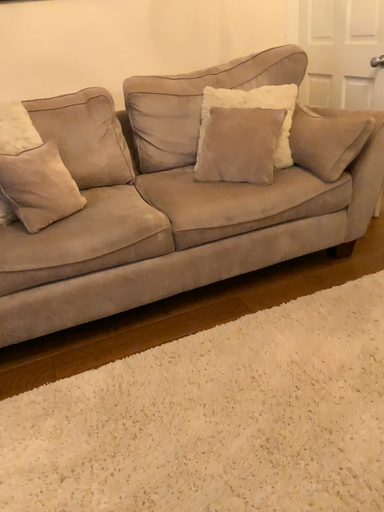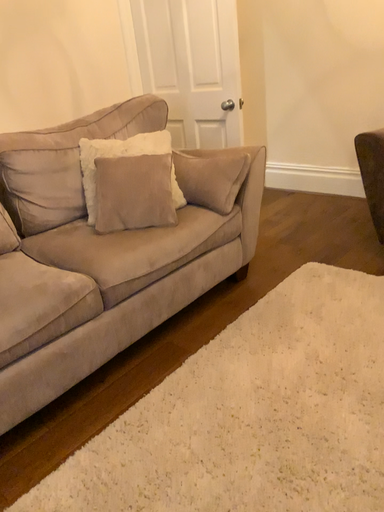
Question: Which way did the camera rotate in the video?

Choices:
 (A) rotated left
 (B) rotated right

Answer: (B)